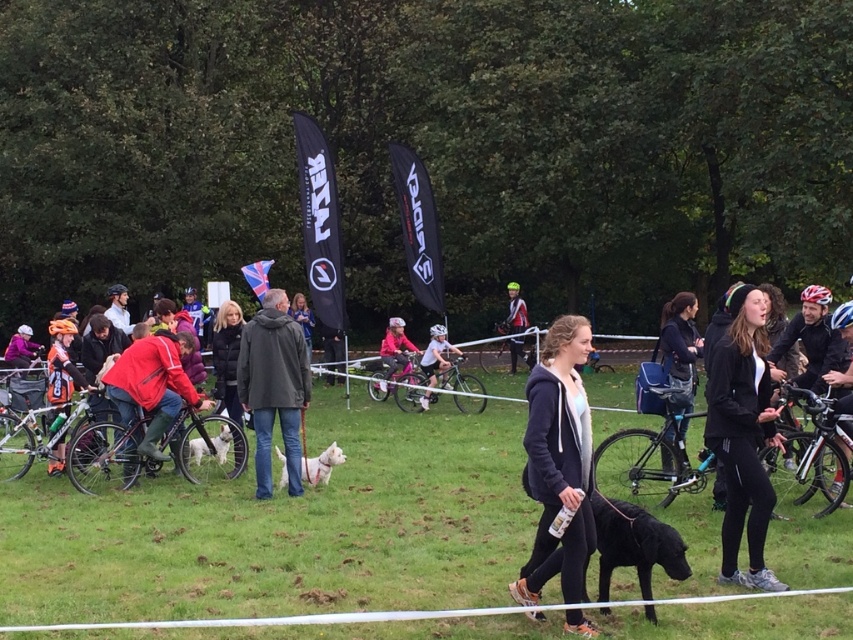
Consider the image. You are standing at the point with coordinates point (x=219, y=440) and want to walk towards the point with coordinates point (x=663, y=362). Which direction should you face to move directly towards your destination?

Point (x=663, y=362) is in front of point (x=219, y=440), so you should face towards the direction of point (x=663, y=362) to move directly towards it.

You are standing in the middle of the field and see two people wearing jackets. One is wearing a dark green jacket at center and the other a dark gray jacket at center. Which jacket is positioned to the right when facing the scene?

The dark green jacket at center is to the right of the dark gray jacket at center.